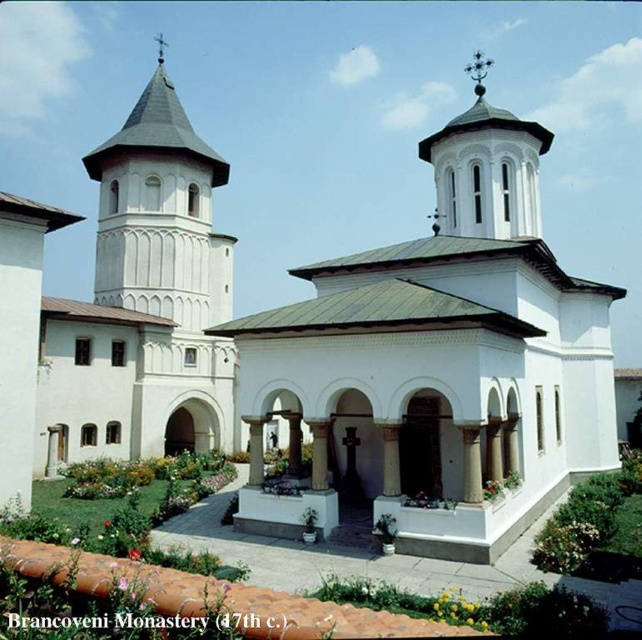
Can you confirm if white smooth chapel at center is positioned to the left of white stucco tower at upper center?

Indeed, white smooth chapel at center is positioned on the left side of white stucco tower at upper center.

Is white smooth chapel at center wider than white stucco tower at upper center?

Indeed, white smooth chapel at center has a greater width compared to white stucco tower at upper center.

Find the location of a particular element. The height and width of the screenshot is (640, 642). white smooth chapel at center is located at coordinates (438, 362).

In order to click on white smooth chapel at center in this screenshot , I will do `click(438, 362)`.

Does white smooth chapel at center come behind white stucco tower at left?

No, white smooth chapel at center is closer to the viewer.

Is white smooth chapel at center below white stucco tower at left?

Yes.

Which is behind, point (603, 360) or point (135, 145)?

Positioned behind is point (135, 145).

In order to click on white smooth chapel at center in this screenshot , I will do `click(438, 362)`.

Is white stucco tower at left further to camera compared to white stucco tower at upper center?

Yes, white stucco tower at left is further from the viewer.

Does white stucco tower at left appear over white stucco tower at upper center?

Indeed, white stucco tower at left is positioned over white stucco tower at upper center.

What do you see at coordinates (160, 214) in the screenshot?
I see `white stucco tower at left` at bounding box center [160, 214].

Identify the location of white stucco tower at left. The height and width of the screenshot is (640, 642). (160, 214).